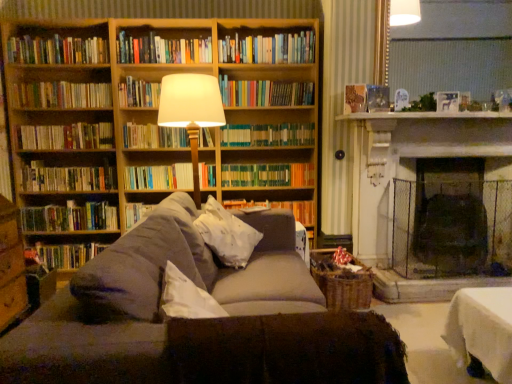
Locate an element on the screen. blank space above hardcover books at center, which is the 2th book from top to bottom (from a real-world perspective) is located at coordinates (264, 32).